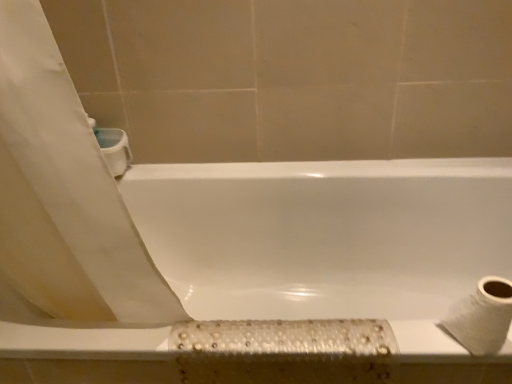
Describe the element at coordinates (335, 245) in the screenshot. I see `white glossy bathtub at center` at that location.

Measure the distance between point (173,227) and camera.

A distance of 1.37 meters exists between point (173,227) and camera.

You are a GUI agent. You are given a task and a screenshot of the screen. Output one action in this format:
    pyautogui.click(x=<x>, y=<y>)
    Task: Click on the white glossy bathtub at center
    This screenshot has height=384, width=512.
    Given the screenshot: What is the action you would take?
    pyautogui.click(x=335, y=245)

The image size is (512, 384). Describe the element at coordinates (482, 317) in the screenshot. I see `white textured toilet paper at lower right` at that location.

The width and height of the screenshot is (512, 384). I want to click on white textured toilet paper at lower right, so click(x=482, y=317).

Identify the location of white glossy bathtub at center. This screenshot has width=512, height=384. (335, 245).

Visually, is white textured toilet paper at lower right positioned to the left or to the right of white glossy bathtub at center?

Based on their positions, white textured toilet paper at lower right is located to the right of white glossy bathtub at center.

Does white textured toilet paper at lower right lie behind white glossy bathtub at center?

No, the depth of white textured toilet paper at lower right is less than that of white glossy bathtub at center.

Which is in front, point (498, 292) or point (362, 198)?

Positioned in front is point (498, 292).

From the image's perspective, which one is positioned lower, white textured toilet paper at lower right or white glossy bathtub at center?

white glossy bathtub at center appears lower in the image.

From a real-world perspective, which object rests below the other?

In real-world perspective, white glossy bathtub at center is lower.

Considering the sizes of white textured toilet paper at lower right and white glossy bathtub at center in the image, is white textured toilet paper at lower right wider or thinner than white glossy bathtub at center?

Considering their sizes, white textured toilet paper at lower right looks slimmer than white glossy bathtub at center.

Does white textured toilet paper at lower right have a greater height compared to white glossy bathtub at center?

In fact, white textured toilet paper at lower right may be shorter than white glossy bathtub at center.

Looking at this image, is white textured toilet paper at lower right bigger than white glossy bathtub at center?

No.

Based on the photo, is white textured toilet paper at lower right inside or outside of white glossy bathtub at center?

white textured toilet paper at lower right exists outside the volume of white glossy bathtub at center.

Is white textured toilet paper at lower right positioned far away from white glossy bathtub at center?

That's not correct — white textured toilet paper at lower right is a little close to white glossy bathtub at center.

Is white textured toilet paper at lower right oriented away from white glossy bathtub at center?

That's not correct — white textured toilet paper at lower right is not looking away from white glossy bathtub at center.

What's the angular difference between white textured toilet paper at lower right and white glossy bathtub at center's facing directions?

They differ by 0.532 degrees in their facing directions.

I want to click on bathtub below the white textured toilet paper at lower right (from the image's perspective), so click(x=335, y=245).

Visually, is white glossy bathtub at center positioned to the left or to the right of white textured toilet paper at lower right?

Based on their positions, white glossy bathtub at center is located to the left of white textured toilet paper at lower right.

Is white glossy bathtub at center positioned before white textured toilet paper at lower right?

That is False.

Considering the points (23, 332) and (507, 327), which point is in front, point (23, 332) or point (507, 327)?

Point (507, 327)

From the image's perspective, is white glossy bathtub at center above or below white textured toilet paper at lower right?

white glossy bathtub at center is below white textured toilet paper at lower right.

In the scene shown: From a real-world perspective, which is physically above, white glossy bathtub at center or white textured toilet paper at lower right?

From a 3D spatial view, white textured toilet paper at lower right is above.

Between white glossy bathtub at center and white textured toilet paper at lower right, which one has smaller width?

Answer: With smaller width is white textured toilet paper at lower right.

From their relative heights in the image, would you say white glossy bathtub at center is taller or shorter than white textured toilet paper at lower right?

In the image, white glossy bathtub at center appears to be taller than white textured toilet paper at lower right.

Considering the sizes of objects white glossy bathtub at center and white textured toilet paper at lower right in the image provided, who is smaller, white glossy bathtub at center or white textured toilet paper at lower right?

Smaller between the two is white textured toilet paper at lower right.

Is white textured toilet paper at lower right completely or partially inside white glossy bathtub at center?

Definitely not — white textured toilet paper at lower right is not inside white glossy bathtub at center.

Is white glossy bathtub at center next to white textured toilet paper at lower right?

No, white glossy bathtub at center is not in contact with white textured toilet paper at lower right.

Could you tell me if white glossy bathtub at center is turned towards white textured toilet paper at lower right?

No, white glossy bathtub at center is not oriented towards white textured toilet paper at lower right.

Where is `toilet paper above the white glossy bathtub at center (from the image's perspective)`? toilet paper above the white glossy bathtub at center (from the image's perspective) is located at coordinates (482, 317).

Find the location of a particular element. The height and width of the screenshot is (384, 512). toilet paper lying above the white glossy bathtub at center (from the image's perspective) is located at coordinates coord(482,317).

Identify the location of bathtub to the left of white textured toilet paper at lower right. (335, 245).